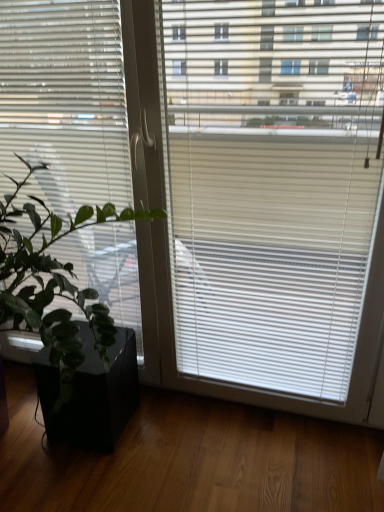
Question: From the image's perspective, is black matte flowerpot at lower left above white matte window blind at left?

Choices:
 (A) no
 (B) yes

Answer: (A)

Question: From a real-world perspective, is black matte flowerpot at lower left on white matte window blind at left?

Choices:
 (A) no
 (B) yes

Answer: (A)

Question: Is black matte flowerpot at lower left closer to the viewer compared to white matte window blind at left?

Choices:
 (A) yes
 (B) no

Answer: (B)

Question: Is black matte flowerpot at lower left touching white matte window blind at left?

Choices:
 (A) yes
 (B) no

Answer: (B)

Question: Considering the relative sizes of black matte flowerpot at lower left and white matte window blind at left in the image provided, is black matte flowerpot at lower left thinner than white matte window blind at left?

Choices:
 (A) yes
 (B) no

Answer: (B)

Question: Can you confirm if black matte flowerpot at lower left is bigger than white matte window blind at left?

Choices:
 (A) yes
 (B) no

Answer: (B)

Question: From a real-world perspective, does white matte window blind at left stand above green matte plant at left?

Choices:
 (A) no
 (B) yes

Answer: (B)

Question: Is white matte window blind at left shorter than green matte plant at left?

Choices:
 (A) yes
 (B) no

Answer: (B)

Question: Considering the relative sizes of white matte window blind at left and green matte plant at left in the image provided, is white matte window blind at left wider than green matte plant at left?

Choices:
 (A) yes
 (B) no

Answer: (B)

Question: Does white matte window blind at left have a smaller size compared to green matte plant at left?

Choices:
 (A) yes
 (B) no

Answer: (A)

Question: Considering the relative positions of white matte window blind at left and green matte plant at left in the image provided, is white matte window blind at left to the left of green matte plant at left from the viewer's perspective?

Choices:
 (A) yes
 (B) no

Answer: (B)

Question: Is white matte window blind at left at the right side of green matte plant at left?

Choices:
 (A) yes
 (B) no

Answer: (A)

Question: Is black matte flowerpot at lower left located within white matte window blind at left?

Choices:
 (A) yes
 (B) no

Answer: (B)